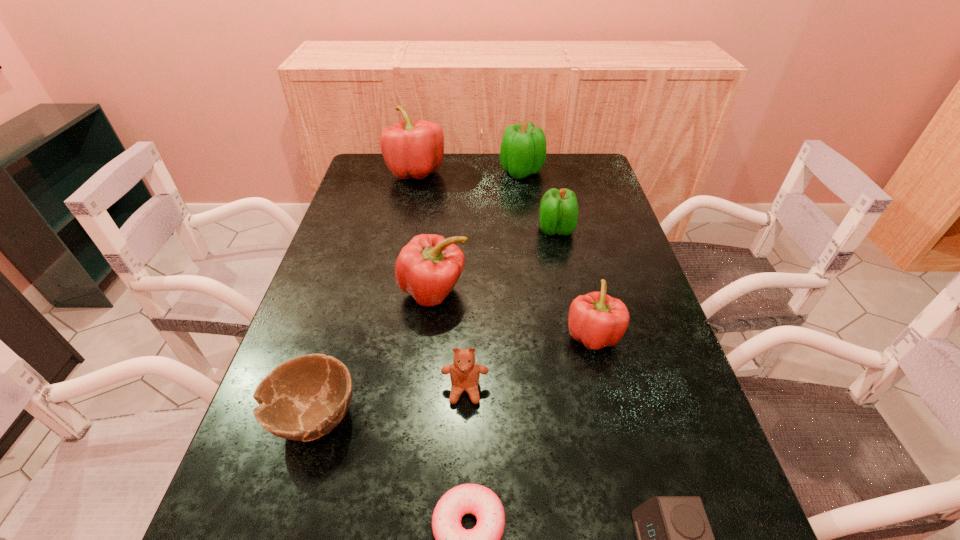
The width and height of the screenshot is (960, 540). Identify the location of vacant space located on the back of the second smallest pink bell pepper. (444, 197).

You are a GUI agent. You are given a task and a screenshot of the screen. Output one action in this format:
    pyautogui.click(x=<x>, y=<y>)
    Task: Click on the free region located 0.260m on the back of the third farthest bell pepper
    
    Given the screenshot: What is the action you would take?
    pyautogui.click(x=544, y=175)

Find the location of a particular element. The width and height of the screenshot is (960, 540). free space located on the left of the smallest pink bell pepper is located at coordinates point(403,336).

You are a GUI agent. You are given a task and a screenshot of the screen. Output one action in this format:
    pyautogui.click(x=<x>, y=<y>)
    Task: Click on the vacant area situated 0.120m on the face of the teddy bear
    This screenshot has height=540, width=960.
    Given the screenshot: What is the action you would take?
    pyautogui.click(x=463, y=466)

This screenshot has width=960, height=540. Identify the location of vacant area situated on the right of the bowl. (x=451, y=417).

At what (x,y) coordinates should I click in order to perform the action: click on bell pepper that is at the left edge. Please return your answer as a coordinate pair (x, y). Looking at the image, I should click on (410, 149).

Find the location of a particular element. bowl that is at the left edge is located at coordinates (304, 398).

The width and height of the screenshot is (960, 540). I want to click on object that is at the far left corner, so click(410, 149).

Identify the location of free space at the left edge. This screenshot has width=960, height=540. (352, 215).

I want to click on blank area at the right edge, so click(x=619, y=279).